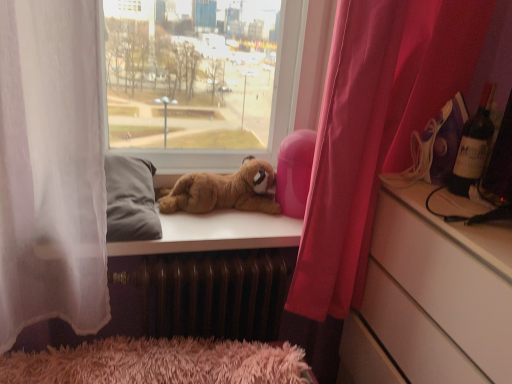
Question: Is the surface of pink fabric curtain at right in direct contact with brown metallic radiator at lower center?

Choices:
 (A) no
 (B) yes

Answer: (A)

Question: Does pink fabric curtain at right turn towards brown metallic radiator at lower center?

Choices:
 (A) yes
 (B) no

Answer: (B)

Question: Considering the relative sizes of pink fabric curtain at right and brown metallic radiator at lower center in the image provided, is pink fabric curtain at right wider than brown metallic radiator at lower center?

Choices:
 (A) no
 (B) yes

Answer: (B)

Question: Is pink fabric curtain at right far away from brown metallic radiator at lower center?

Choices:
 (A) no
 (B) yes

Answer: (A)

Question: Is pink fabric curtain at right smaller than brown metallic radiator at lower center?

Choices:
 (A) yes
 (B) no

Answer: (B)

Question: Visually, is brown metallic radiator at lower center positioned to the left or to the right of pink fabric curtain at right?

Choices:
 (A) right
 (B) left

Answer: (B)

Question: Considering the positions of brown metallic radiator at lower center and pink fabric curtain at right in the image, is brown metallic radiator at lower center taller or shorter than pink fabric curtain at right?

Choices:
 (A) short
 (B) tall

Answer: (A)

Question: Is brown metallic radiator at lower center inside or outside of pink fabric curtain at right?

Choices:
 (A) inside
 (B) outside

Answer: (B)

Question: Relative to pink fabric curtain at right, is brown metallic radiator at lower center in front or behind?

Choices:
 (A) behind
 (B) front

Answer: (A)

Question: Looking at the image, does dark red glass wine bottle at upper right seem bigger or smaller compared to white glossy cabinet at right?

Choices:
 (A) big
 (B) small

Answer: (B)

Question: Is dark red glass wine bottle at upper right spatially inside white glossy cabinet at right, or outside of it?

Choices:
 (A) outside
 (B) inside

Answer: (A)

Question: In the image, is dark red glass wine bottle at upper right positioned in front of or behind white glossy cabinet at right?

Choices:
 (A) behind
 (B) front

Answer: (A)

Question: Considering the positions of dark red glass wine bottle at upper right and white glossy cabinet at right in the image, is dark red glass wine bottle at upper right wider or thinner than white glossy cabinet at right?

Choices:
 (A) wide
 (B) thin

Answer: (B)

Question: From the image's perspective, is pink fabric curtain at right located above or below dark red glass wine bottle at upper right?

Choices:
 (A) below
 (B) above

Answer: (A)

Question: Is pink fabric curtain at right to the left or to the right of dark red glass wine bottle at upper right in the image?

Choices:
 (A) right
 (B) left

Answer: (B)